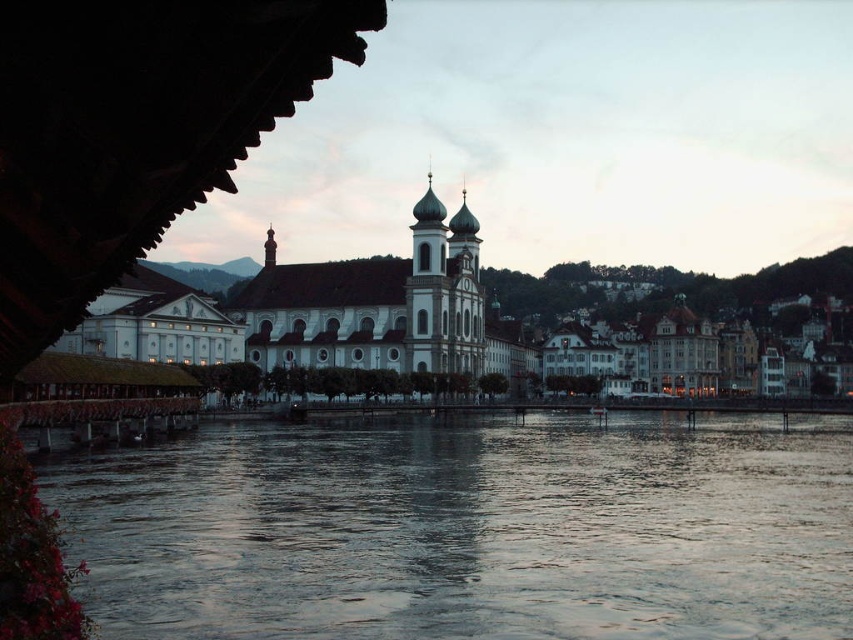
Question: Does dark water at center appear under white stone church at center?

Choices:
 (A) yes
 (B) no

Answer: (A)

Question: In this image, where is dark water at center located relative to white stone church at center?

Choices:
 (A) left
 (B) right

Answer: (A)

Question: Among these objects, which one is nearest to the camera?

Choices:
 (A) white stone church at center
 (B) dark water at center

Answer: (B)

Question: Which point is farther from the camera taking this photo?

Choices:
 (A) (434, 356)
 (B) (314, 525)

Answer: (A)

Question: Is dark water at center further to the viewer compared to white stone church at center?

Choices:
 (A) no
 (B) yes

Answer: (A)